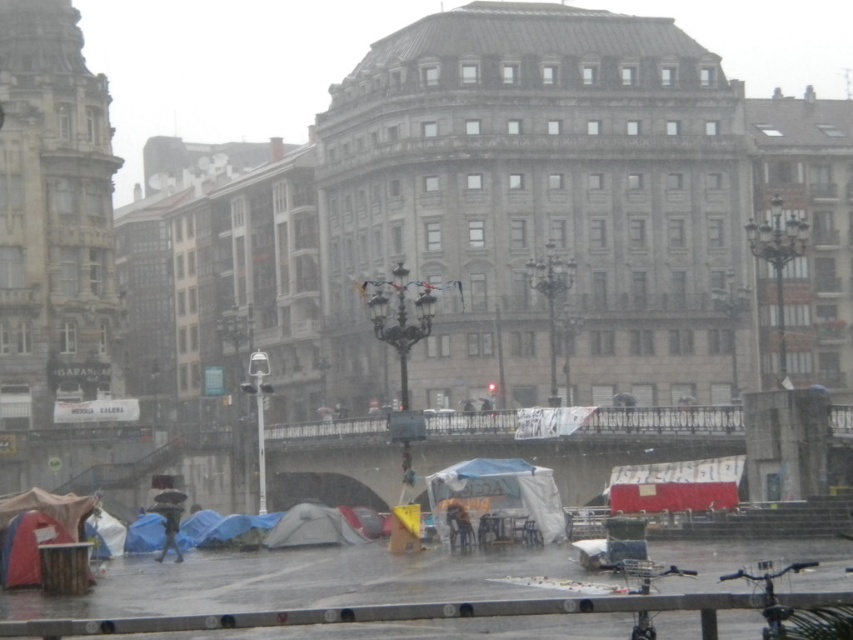
Question: Based on their relative distances, which object is farther from the gray fabric tent at lower center?

Choices:
 (A) blue tarp at lower left
 (B) white canvas tent at center

Answer: (B)

Question: Which point is farther to the camera?

Choices:
 (A) white canvas tent at center
 (B) gray fabric tent at lower center
 (C) blue tarp at lower left

Answer: (C)

Question: Observing the image, what is the correct spatial positioning of white canvas tent at center in reference to gray fabric tent at lower center?

Choices:
 (A) left
 (B) right

Answer: (B)

Question: Which object is farther from the camera taking this photo?

Choices:
 (A) white canvas tent at center
 (B) gray fabric tent at lower center

Answer: (B)

Question: Can you confirm if white canvas tent at center is positioned to the left of blue tarp at lower left?

Choices:
 (A) no
 (B) yes

Answer: (A)

Question: Can you confirm if gray fabric tent at lower center is smaller than blue tarp at lower left?

Choices:
 (A) no
 (B) yes

Answer: (B)